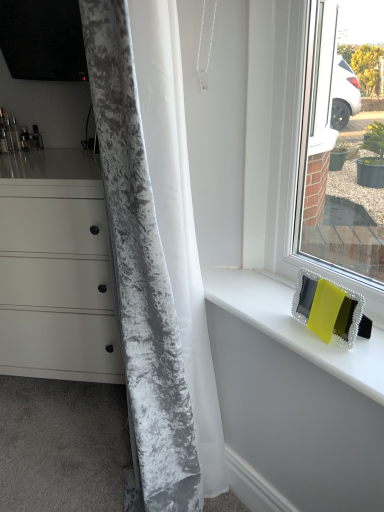
Question: Is yellow fabric at upper right wider than matte yellow frame at right?

Choices:
 (A) yes
 (B) no

Answer: (A)

Question: Can you confirm if yellow fabric at upper right is positioned to the left of matte yellow frame at right?

Choices:
 (A) yes
 (B) no

Answer: (A)

Question: Is yellow fabric at upper right with matte yellow frame at right?

Choices:
 (A) no
 (B) yes

Answer: (A)

Question: Can you confirm if yellow fabric at upper right is shorter than matte yellow frame at right?

Choices:
 (A) yes
 (B) no

Answer: (A)

Question: Is yellow fabric at upper right thinner than matte yellow frame at right?

Choices:
 (A) yes
 (B) no

Answer: (B)

Question: Is yellow fabric at upper right not near matte yellow frame at right?

Choices:
 (A) no
 (B) yes

Answer: (A)

Question: Can you confirm if matte white chest of drawers at left is shorter than velvet gray curtain at left?

Choices:
 (A) yes
 (B) no

Answer: (A)

Question: Is matte white chest of drawers at left looking in the opposite direction of velvet gray curtain at left?

Choices:
 (A) yes
 (B) no

Answer: (B)

Question: Can you confirm if matte white chest of drawers at left is smaller than velvet gray curtain at left?

Choices:
 (A) yes
 (B) no

Answer: (B)

Question: Does matte white chest of drawers at left turn towards velvet gray curtain at left?

Choices:
 (A) no
 (B) yes

Answer: (A)

Question: From a real-world perspective, is matte white chest of drawers at left over velvet gray curtain at left?

Choices:
 (A) no
 (B) yes

Answer: (A)

Question: Is matte white chest of drawers at left to the right of velvet gray curtain at left from the viewer's perspective?

Choices:
 (A) no
 (B) yes

Answer: (A)

Question: Is velvet gray curtain at left further to camera compared to yellow fabric at upper right?

Choices:
 (A) yes
 (B) no

Answer: (B)